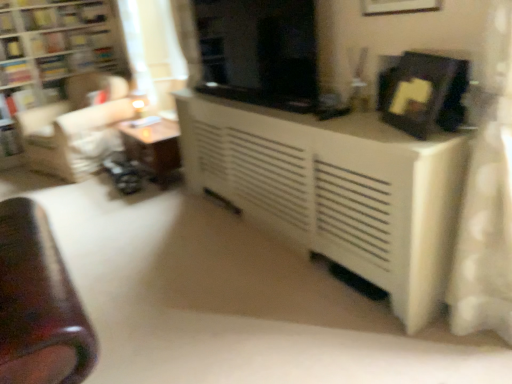
Question: Looking at their shapes, would you say hardcover book at upper left, which ranks as the second book in top-to-bottom order, is wider or thinner than white sheer curtain at upper left?

Choices:
 (A) wide
 (B) thin

Answer: (B)

Question: Considering the positions of point (10, 16) and point (154, 28), is point (10, 16) closer or farther from the camera than point (154, 28)?

Choices:
 (A) farther
 (B) closer

Answer: (A)

Question: Considering the real-world distances, which object is farthest from the black matte picture frame at upper right, which ranks as the 2th picture frame in top-to-bottom order?

Choices:
 (A) matte black picture frame at upper center, the first picture frame viewed from the top
 (B) black glossy screen door at center
 (C) matte black swivel chair at left
 (D) hardcover book at upper left, the 4th book from the bottom
 (E) white sheer curtain at upper left

Answer: (D)

Question: Which object is the closest to the black matte picture frame at upper right, which ranks as the 2th picture frame in top-to-bottom order?

Choices:
 (A) hardcover book at upper left, which is the 7th book from bottom to top
 (B) hardcover book at upper left, placed as the third book when sorted from top to bottom
 (C) white sheer curtain at upper left
 (D) hardcover book at left, the 2th book when ordered from bottom to top
 (E) matte black swivel chair at left

Answer: (C)